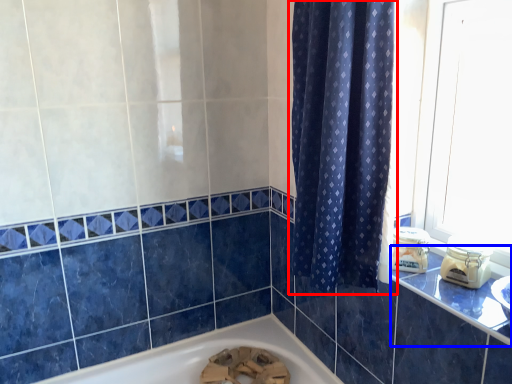
Question: Which point is closer to the camera, curtain (highlighted by a red box) or counter top (highlighted by a blue box)?

Choices:
 (A) curtain
 (B) counter top

Answer: (B)